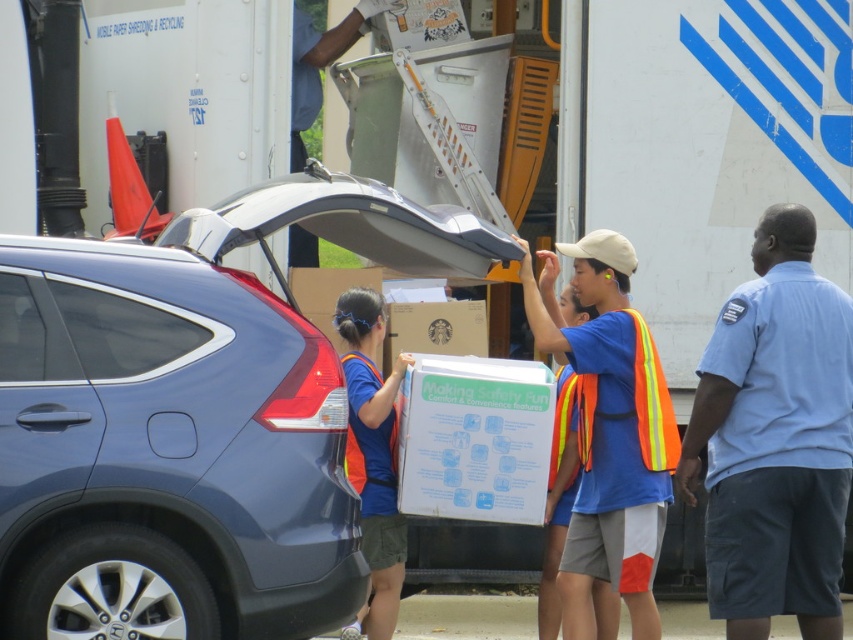
Is matte blue car at center-left shorter than light blue shirt at right?

In fact, matte blue car at center-left may be taller than light blue shirt at right.

Between point (18, 262) and point (692, 449), which one is positioned in front?

Point (18, 262) is in front.

Measure the distance between matte blue car at center-left and camera.

matte blue car at center-left and camera are 7.28 meters apart.

At what (x,y) coordinates should I click in order to perform the action: click on matte blue car at center-left. Please return your answer as a coordinate pair (x, y). Looking at the image, I should click on (190, 419).